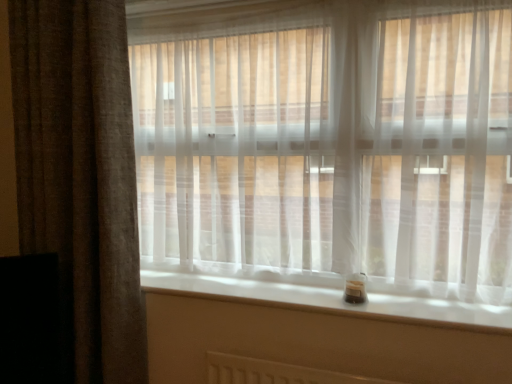
Where is `free point below translucent white curtain at center, placed as the 1th curtain when sorted from right to left (from a real-world perspective)`? This screenshot has width=512, height=384. free point below translucent white curtain at center, placed as the 1th curtain when sorted from right to left (from a real-world perspective) is located at coordinates (329, 289).